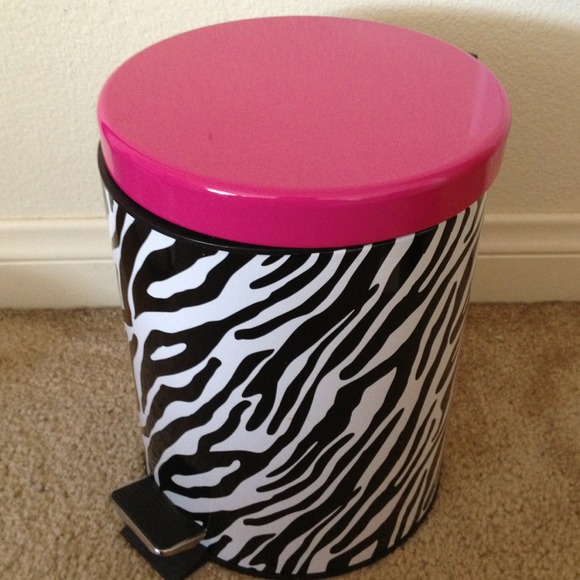
Locate an element on the screen. Image resolution: width=580 pixels, height=580 pixels. trashcan is located at coordinates (309, 295).